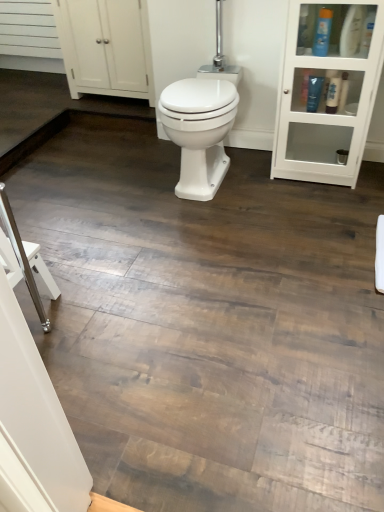
Question: Is white glossy bidet at center oriented away from blue plastic bottle at upper right, the second toiletry when ordered from left to right?

Choices:
 (A) yes
 (B) no

Answer: (B)

Question: Can you confirm if white glossy bidet at center is shorter than blue plastic bottle at upper right, which is counted as the second toiletry, starting from the right?

Choices:
 (A) yes
 (B) no

Answer: (B)

Question: Considering the relative sizes of white glossy bidet at center and blue plastic bottle at upper right, the second toiletry when ordered from left to right, in the image provided, is white glossy bidet at center bigger than blue plastic bottle at upper right, the second toiletry when ordered from left to right,?

Choices:
 (A) no
 (B) yes

Answer: (B)

Question: From the image's perspective, would you say white glossy bidet at center is positioned over blue plastic bottle at upper right, the second toiletry when ordered from left to right?

Choices:
 (A) no
 (B) yes

Answer: (A)

Question: Does white glossy bidet at center have a greater width compared to blue plastic bottle at upper right, the second toiletry when ordered from left to right?

Choices:
 (A) no
 (B) yes

Answer: (B)

Question: Would you say blue plastic bottle at upper right, which is counted as the second toiletry, starting from the right, is part of white glossy bidet at center's contents?

Choices:
 (A) no
 (B) yes

Answer: (A)

Question: Is the position of white glass cabinet at upper right less distant than that of blue plastic bottle at upper right, which appears as the third toiletry when viewed from the left?

Choices:
 (A) yes
 (B) no

Answer: (A)

Question: Does white glass cabinet at upper right have a greater width compared to blue plastic bottle at upper right, arranged as the 1th toiletry when viewed from the right?

Choices:
 (A) yes
 (B) no

Answer: (A)

Question: Considering the relative sizes of white glass cabinet at upper right and blue plastic bottle at upper right, which appears as the third toiletry when viewed from the left, in the image provided, is white glass cabinet at upper right taller than blue plastic bottle at upper right, which appears as the third toiletry when viewed from the left,?

Choices:
 (A) no
 (B) yes

Answer: (B)

Question: From the image's perspective, does white glass cabinet at upper right appear lower than blue plastic bottle at upper right, arranged as the 1th toiletry when viewed from the right?

Choices:
 (A) no
 (B) yes

Answer: (B)

Question: Can you confirm if white glass cabinet at upper right is bigger than blue plastic bottle at upper right, which appears as the third toiletry when viewed from the left?

Choices:
 (A) no
 (B) yes

Answer: (B)

Question: Is white glass cabinet at upper right to the left of blue plastic bottle at upper right, which appears as the third toiletry when viewed from the left, from the viewer's perspective?

Choices:
 (A) no
 (B) yes

Answer: (B)

Question: Is blue plastic bottle at upper right, arranged as the 1th toiletry when viewed from the right, positioned with its back to white matte cabinet at upper left?

Choices:
 (A) no
 (B) yes

Answer: (A)